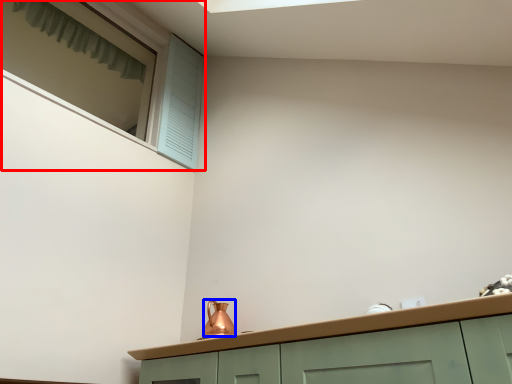
Question: Which object appears closest to the camera in this image, window (highlighted by a red box) or tea pot (highlighted by a blue box)?

Choices:
 (A) window
 (B) tea pot

Answer: (B)